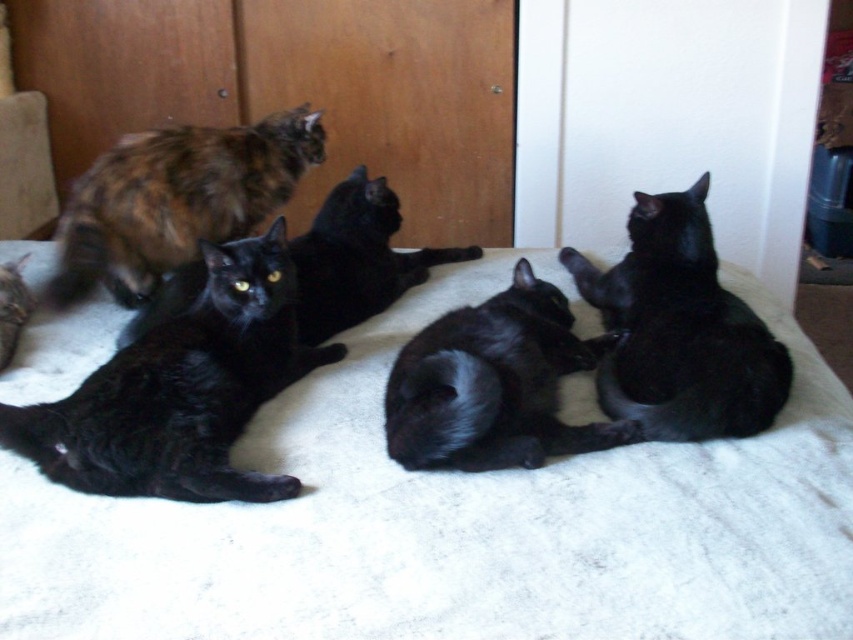
Question: Does shiny black cat at center appear on the left side of black glossy cat at center?

Choices:
 (A) yes
 (B) no

Answer: (B)

Question: Which point is farther to the camera?

Choices:
 (A) (3, 324)
 (B) (727, 312)
 (C) (531, 360)
 (D) (344, 234)

Answer: (D)

Question: Among these objects, which one is farthest from the camera?

Choices:
 (A) shiny black cat at left
 (B) shiny black cat at center
 (C) multicolored fur cat at upper left
 (D) shiny black cat at lower left

Answer: (C)

Question: Does shiny black cat at left appear on the left side of shiny black cat at center?

Choices:
 (A) no
 (B) yes

Answer: (B)

Question: Which object is closer to the camera taking this photo?

Choices:
 (A) black glossy cat at upper right
 (B) shiny black cat at lower left

Answer: (A)

Question: In this image, where is white soft bed at center located relative to black glossy cat at upper right?

Choices:
 (A) right
 (B) left

Answer: (B)